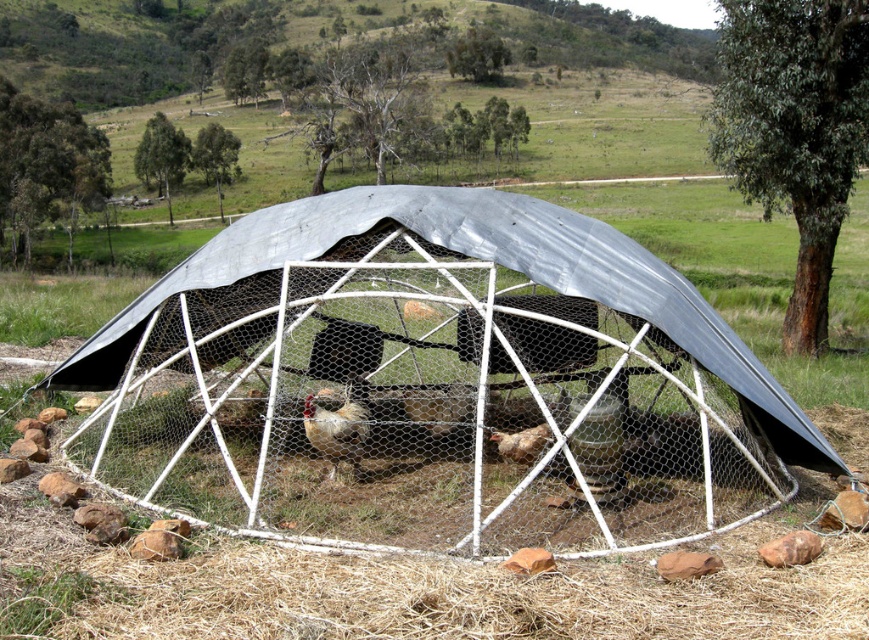
Does point (556, 436) come closer to viewer compared to point (514, 440)?

Yes, point (556, 436) is closer to viewer.

Who is higher up, metallic wire mesh cage at center or brown speckled feathers at center?

metallic wire mesh cage at center is higher up.

Locate an element on the screen. The width and height of the screenshot is (869, 640). metallic wire mesh cage at center is located at coordinates [438, 381].

This screenshot has width=869, height=640. I want to click on metallic wire mesh cage at center, so click(438, 381).

Which is above, golden brown feathers at center or brown speckled feathers at center?

golden brown feathers at center is above.

Does golden brown feathers at center have a smaller size compared to brown speckled feathers at center?

Actually, golden brown feathers at center might be larger than brown speckled feathers at center.

Where is `golden brown feathers at center`? The width and height of the screenshot is (869, 640). golden brown feathers at center is located at coordinates (337, 432).

Consider the image. Can you confirm if metallic wire mesh cage at center is smaller than golden brown feathers at center?

Actually, metallic wire mesh cage at center might be larger than golden brown feathers at center.

Locate an element on the screen. The width and height of the screenshot is (869, 640). metallic wire mesh cage at center is located at coordinates (438, 381).